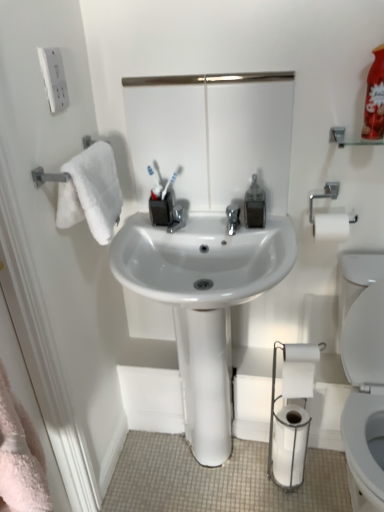
Question: Is the position of white glossy sink at center less distant than that of white matte toilet paper at lower right, the 2th toilet paper positioned from the bottom?

Choices:
 (A) yes
 (B) no

Answer: (A)

Question: Is white glossy sink at center thinner than white matte toilet paper at lower right, the 2th toilet paper positioned from the bottom?

Choices:
 (A) no
 (B) yes

Answer: (A)

Question: Is white glossy sink at center smaller than white matte toilet paper at lower right, the 2th toilet paper positioned from the bottom?

Choices:
 (A) no
 (B) yes

Answer: (A)

Question: Is white glossy sink at center looking in the opposite direction of white matte toilet paper at lower right, acting as the 1th toilet paper starting from the top?

Choices:
 (A) no
 (B) yes

Answer: (A)

Question: Can you confirm if white glossy sink at center is wider than white matte toilet paper at lower right, acting as the 1th toilet paper starting from the top?

Choices:
 (A) yes
 (B) no

Answer: (A)

Question: Considering the positions of point (253, 190) and point (240, 287), is point (253, 190) closer or farther from the camera than point (240, 287)?

Choices:
 (A) closer
 (B) farther

Answer: (B)

Question: From the image's perspective, is clear plastic soap dispenser at center located above or below white glossy sink at center?

Choices:
 (A) below
 (B) above

Answer: (B)

Question: Visually, is clear plastic soap dispenser at center positioned to the left or to the right of white glossy sink at center?

Choices:
 (A) left
 (B) right

Answer: (B)

Question: Is clear plastic soap dispenser at center wider or thinner than white glossy sink at center?

Choices:
 (A) thin
 (B) wide

Answer: (A)

Question: From a real-world perspective, is white matte toilet paper at lower right, the 1th toilet paper positioned from the bottom, physically located above or below white glossy mirror at upper center?

Choices:
 (A) below
 (B) above

Answer: (A)

Question: Looking at their shapes, would you say white matte toilet paper at lower right, the 1th toilet paper positioned from the bottom, is wider or thinner than white glossy mirror at upper center?

Choices:
 (A) thin
 (B) wide

Answer: (B)

Question: In the image, is white matte toilet paper at lower right, the 2th toilet paper from the top, on the left side or the right side of white glossy mirror at upper center?

Choices:
 (A) left
 (B) right

Answer: (B)

Question: Based on their sizes in the image, would you say white matte toilet paper at lower right, the 2th toilet paper from the top, is bigger or smaller than white glossy mirror at upper center?

Choices:
 (A) small
 (B) big

Answer: (A)

Question: In terms of height, does white matte toilet paper at lower right, the 2th toilet paper positioned from the bottom, look taller or shorter compared to white glossy sink at center?

Choices:
 (A) tall
 (B) short

Answer: (B)

Question: From the image's perspective, is white matte toilet paper at lower right, acting as the 1th toilet paper starting from the top, positioned above or below white glossy sink at center?

Choices:
 (A) above
 (B) below

Answer: (B)